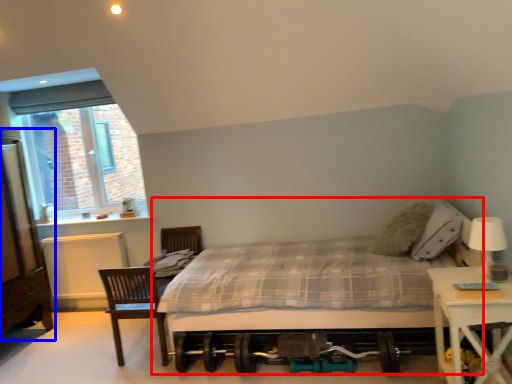
Question: Which point is further to the camera, bed (highlighted by a red box) or dresser (highlighted by a blue box)?

Choices:
 (A) bed
 (B) dresser

Answer: (B)